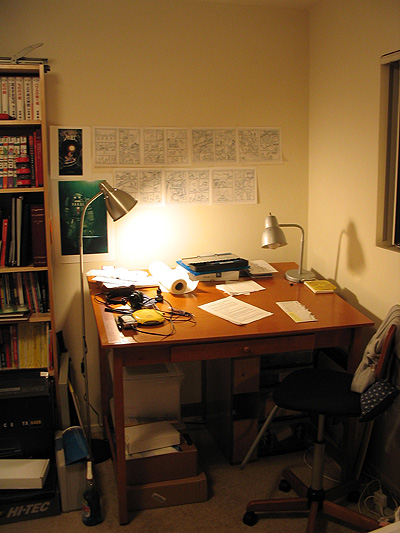
The height and width of the screenshot is (533, 400). I want to click on desktop, so click(x=330, y=305).